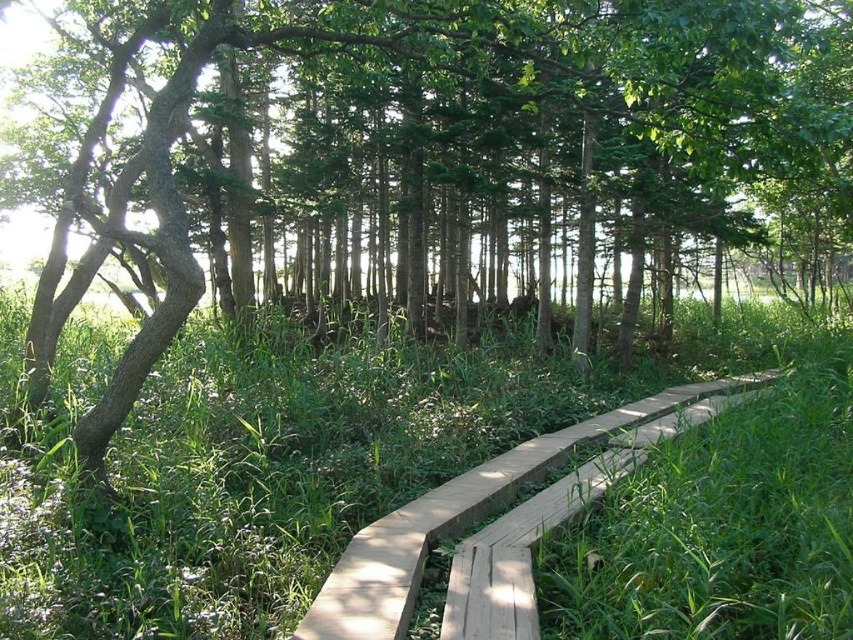
Between green grass at center and natural wood boardwalk at center, which one has more height?

green grass at center is taller.

Consider the image. Between green grass at center and natural wood boardwalk at center, which one appears on the left side from the viewer's perspective?

green grass at center is more to the left.

Locate an element on the screen. The image size is (853, 640). green grass at center is located at coordinates (418, 480).